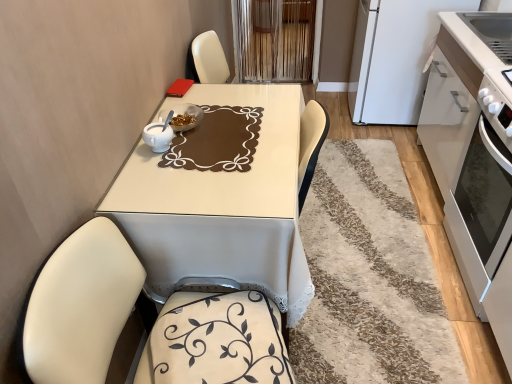
You are a GUI agent. You are given a task and a screenshot of the screen. Output one action in this format:
    pyautogui.click(x=<x>, y=<y>)
    Task: Click on the vacant space underneath white glossy bowl at center (from a real-world perspective)
    This screenshot has width=512, height=384.
    Given the screenshot: What is the action you would take?
    pyautogui.click(x=183, y=125)